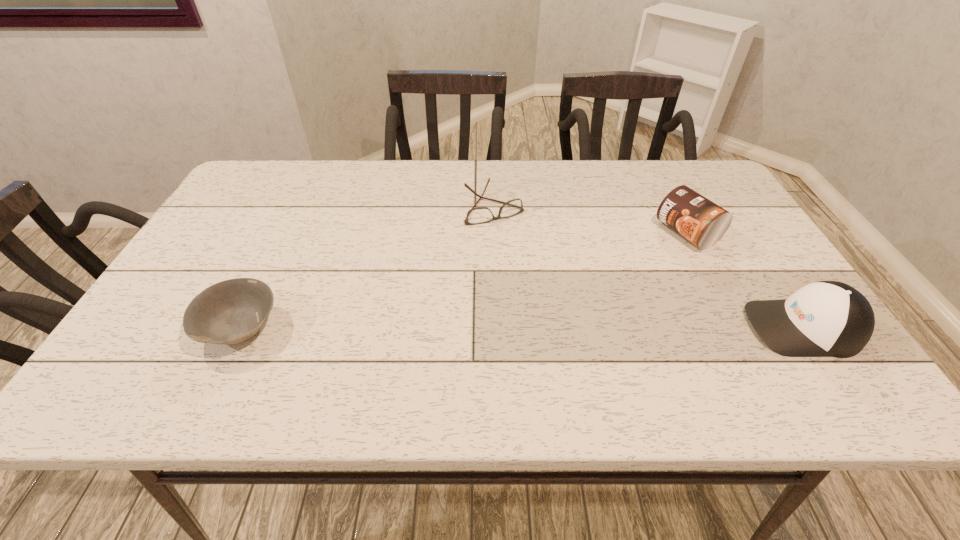
The height and width of the screenshot is (540, 960). Find the location of `vacant space located on the front-facing side of the shortest object`. vacant space located on the front-facing side of the shortest object is located at coordinates pyautogui.click(x=537, y=273).

Where is `free space located on the front-facing side of the shortest object`? The width and height of the screenshot is (960, 540). free space located on the front-facing side of the shortest object is located at coordinates (534, 267).

The height and width of the screenshot is (540, 960). What are the coordinates of `vacant space situated on the front-facing side of the shortest object` in the screenshot? It's located at 520,247.

Identify the location of free location located 0.260m on the front label of the can. Image resolution: width=960 pixels, height=540 pixels. (588, 280).

This screenshot has height=540, width=960. Identify the location of vacant region located 0.210m on the front label of the can. (604, 273).

The width and height of the screenshot is (960, 540). What are the coordinates of `blank space located 0.080m on the front label of the can` in the screenshot? It's located at (642, 254).

Where is `object at the far edge`? The image size is (960, 540). object at the far edge is located at coordinates [480, 215].

This screenshot has height=540, width=960. In order to click on bowl that is at the near edge in this screenshot , I will do `click(229, 312)`.

Find the location of `cap that is at the near edge`. cap that is at the near edge is located at coordinates (826, 318).

The height and width of the screenshot is (540, 960). In order to click on object situated at the left edge in this screenshot , I will do `click(229, 312)`.